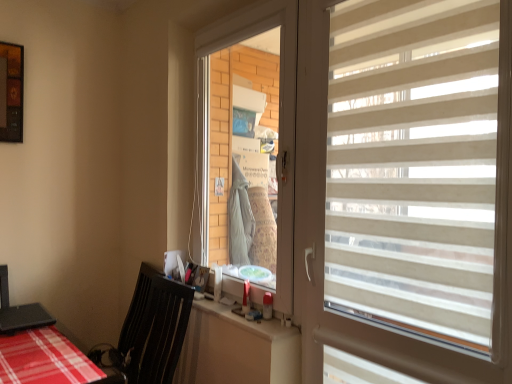
Question: Does beige striped window blind at right have a smaller size compared to black plastic swivel chair at lower left?

Choices:
 (A) no
 (B) yes

Answer: (B)

Question: Does beige striped window blind at right have a lesser height compared to black plastic swivel chair at lower left?

Choices:
 (A) no
 (B) yes

Answer: (A)

Question: Can you confirm if beige striped window blind at right is bigger than black plastic swivel chair at lower left?

Choices:
 (A) yes
 (B) no

Answer: (B)

Question: Is beige striped window blind at right surrounding black plastic swivel chair at lower left?

Choices:
 (A) yes
 (B) no

Answer: (B)

Question: Can you confirm if beige striped window blind at right is thinner than black plastic swivel chair at lower left?

Choices:
 (A) no
 (B) yes

Answer: (B)

Question: Choose the correct answer: Is transparent plastic window screen at center inside beige striped window blind at right or outside it?

Choices:
 (A) outside
 (B) inside

Answer: (A)

Question: Is transparent plastic window screen at center to the left or to the right of beige striped window blind at right in the image?

Choices:
 (A) left
 (B) right

Answer: (A)

Question: Considering the positions of transparent plastic window screen at center and beige striped window blind at right in the image, is transparent plastic window screen at center taller or shorter than beige striped window blind at right?

Choices:
 (A) tall
 (B) short

Answer: (B)

Question: In terms of width, does transparent plastic window screen at center look wider or thinner when compared to beige striped window blind at right?

Choices:
 (A) thin
 (B) wide

Answer: (A)

Question: Considering the positions of transparent plastic window screen at center and white plastic counter top at lower center in the image, is transparent plastic window screen at center taller or shorter than white plastic counter top at lower center?

Choices:
 (A) tall
 (B) short

Answer: (A)

Question: Is transparent plastic window screen at center inside or outside of white plastic counter top at lower center?

Choices:
 (A) outside
 (B) inside

Answer: (A)

Question: Relative to white plastic counter top at lower center, is transparent plastic window screen at center in front or behind?

Choices:
 (A) front
 (B) behind

Answer: (B)

Question: Is point (202, 251) closer or farther from the camera than point (239, 299)?

Choices:
 (A) closer
 (B) farther

Answer: (B)

Question: Looking at the image, does beige striped window blind at right seem bigger or smaller compared to black plastic swivel chair at lower left?

Choices:
 (A) big
 (B) small

Answer: (B)

Question: Considering the positions of point (480, 291) and point (136, 352), is point (480, 291) closer or farther from the camera than point (136, 352)?

Choices:
 (A) closer
 (B) farther

Answer: (A)